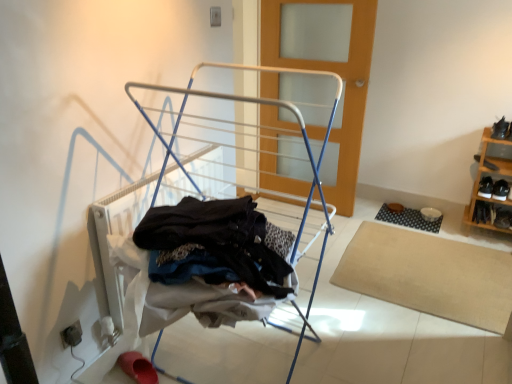
Question: From the image's perspective, is rubber shoe at lower left, marked as the first footwear in a left-to-right arrangement, over white metal drying rack at center?

Choices:
 (A) yes
 (B) no

Answer: (B)

Question: Does rubber shoe at lower left, the second footwear positioned from the back, lie in front of white metal drying rack at center?

Choices:
 (A) yes
 (B) no

Answer: (B)

Question: From the image's perspective, is rubber shoe at lower left, which is the second footwear from right to left, beneath white metal drying rack at center?

Choices:
 (A) no
 (B) yes

Answer: (B)

Question: Would you say rubber shoe at lower left, marked as the first footwear in a left-to-right arrangement, contains white metal drying rack at center?

Choices:
 (A) no
 (B) yes

Answer: (A)

Question: From a real-world perspective, is rubber shoe at lower left, which is the second footwear from right to left, on top of white metal drying rack at center?

Choices:
 (A) yes
 (B) no

Answer: (B)

Question: Considering the relative sizes of rubber shoe at lower left, arranged as the 1th footwear when ordered from the bottom, and white metal drying rack at center in the image provided, is rubber shoe at lower left, arranged as the 1th footwear when ordered from the bottom, smaller than white metal drying rack at center?

Choices:
 (A) yes
 (B) no

Answer: (A)

Question: From the image's perspective, would you say black leather shoe at upper right, positioned as the fifth shoe in bottom-to-top order, is shown under black leather shoe at lower right, which ranks as the 3th shoe in bottom-to-top order?

Choices:
 (A) no
 (B) yes

Answer: (A)

Question: From the image's perspective, is black leather shoe at upper right, positioned as the fifth shoe in bottom-to-top order, over black leather shoe at lower right, which ranks as the 3th shoe in bottom-to-top order?

Choices:
 (A) yes
 (B) no

Answer: (A)

Question: Does black leather shoe at upper right, arranged as the first shoe when viewed from the top, have a lesser height compared to black leather shoe at lower right, which ranks as the 3th shoe in top-to-bottom order?

Choices:
 (A) yes
 (B) no

Answer: (B)

Question: From a real-world perspective, is black leather shoe at upper right, positioned as the fifth shoe in bottom-to-top order, positioned under black leather shoe at lower right, which ranks as the 3th shoe in bottom-to-top order, based on gravity?

Choices:
 (A) yes
 (B) no

Answer: (B)

Question: Does black leather shoe at upper right, positioned as the fifth shoe in bottom-to-top order, have a smaller size compared to black leather shoe at lower right, which ranks as the 3th shoe in bottom-to-top order?

Choices:
 (A) yes
 (B) no

Answer: (B)

Question: Would you say black leather shoe at upper right, positioned as the fifth shoe in bottom-to-top order, is a long distance from black leather shoe at lower right, which ranks as the 3th shoe in bottom-to-top order?

Choices:
 (A) yes
 (B) no

Answer: (B)

Question: Is black rubber mat at lower right, which is counted as the 1th mat, starting from the back, further to the viewer compared to black leather shoe at right, acting as the fourth shoe starting from the bottom?

Choices:
 (A) no
 (B) yes

Answer: (B)